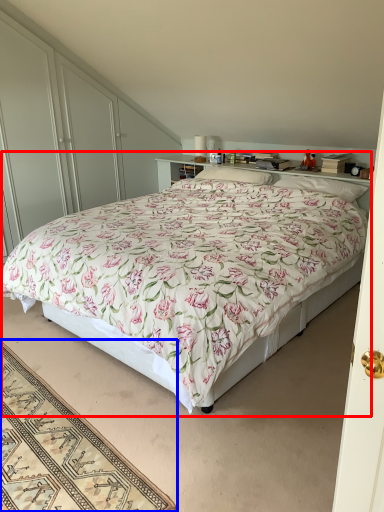
Question: Which of the following is the farthest to the observer, bed (highlighted by a red box) or mat (highlighted by a blue box)?

Choices:
 (A) bed
 (B) mat

Answer: (A)